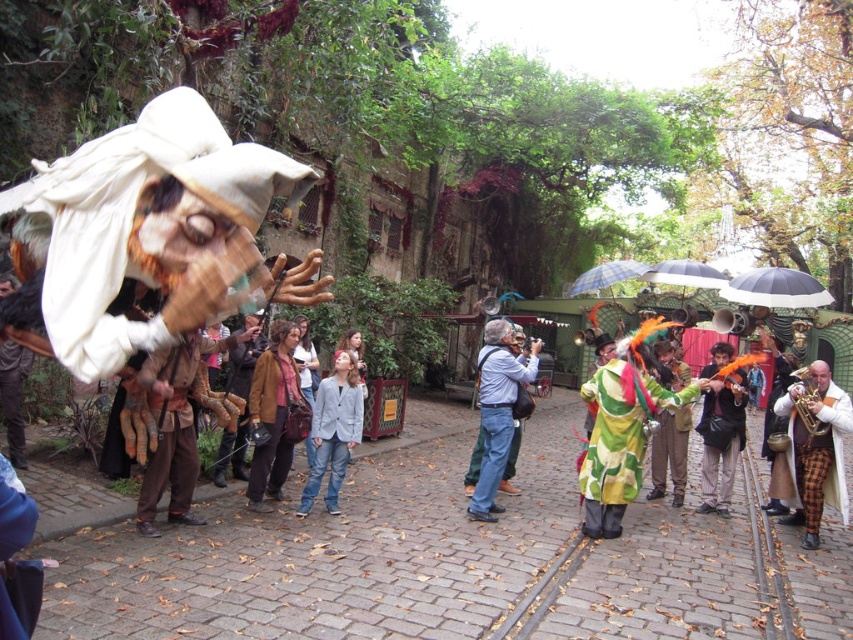
Does point (711, 417) come closer to viewer compared to point (306, 493)?

No, (711, 417) is behind (306, 493).

Locate an element on the screen. The width and height of the screenshot is (853, 640). multicolored feathered costume at center is located at coordinates (720, 428).

Between point (782, 400) and point (305, 509), which one is positioned in front?

Point (305, 509)

Who is more distant from viewer, (830,392) or (312,412)?

The point (830,392) is more distant.

Where is `plaid wool pants at right`? The width and height of the screenshot is (853, 640). plaid wool pants at right is located at coordinates (813, 449).

Does green fabric costume at center appear on the right side of light gray cotton jacket at center?

Correct, you'll find green fabric costume at center to the right of light gray cotton jacket at center.

What are the coordinates of `green fabric costume at center` in the screenshot? It's located at (497, 410).